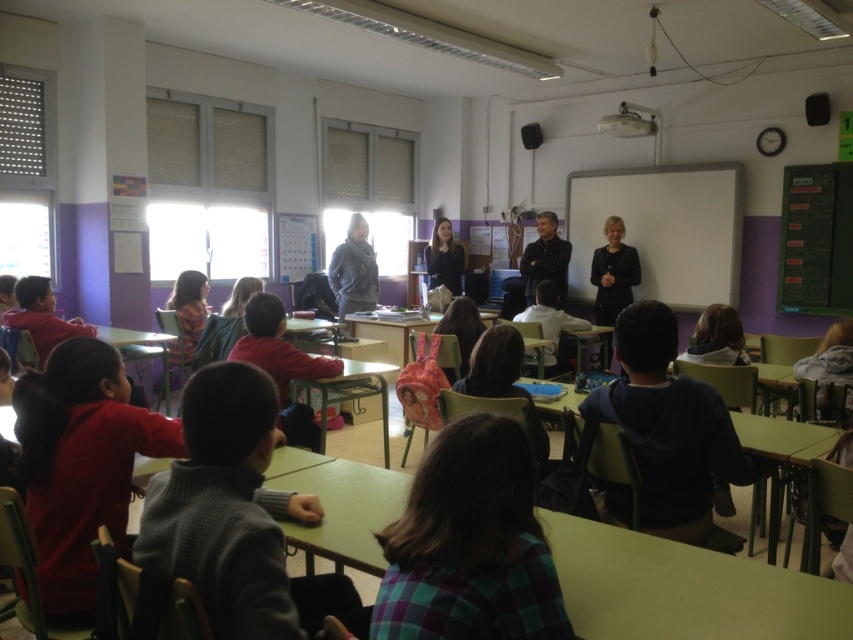
You are a student trying to place your dark blue fabric backpack at lower right next to your dark gray sweater at center on the desk. Will the backpack fit vertically without overlapping the sweater?

The dark blue fabric backpack at lower right is not as tall as the dark gray sweater at center, so it will fit vertically without overlapping.

You are standing at the back of the classroom and want to take a photo of both the point at coordinates point (637, 397) and point (548, 234). Which point will appear larger in the photo?

Point (637, 397) is closer to the camera than point (548, 234), so it will appear larger in the photo.

Based on the photo, you are a teacher in the classroom and need to write an important note. Which object, the green chalkboard at right or the green plastic table at center, is more suitable for writing?

The green chalkboard at right is more suitable for writing because it is designed for that purpose, unlike the green plastic table at center which is meant for placing objects.